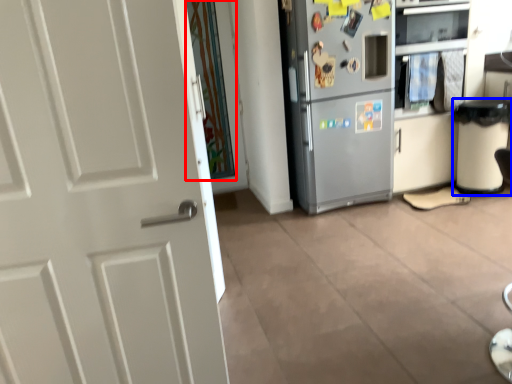
Question: Which object appears closest to the camera in this image, glass door (highlighted by a red box) or trash bin/can (highlighted by a blue box)?

Choices:
 (A) glass door
 (B) trash bin/can

Answer: (B)